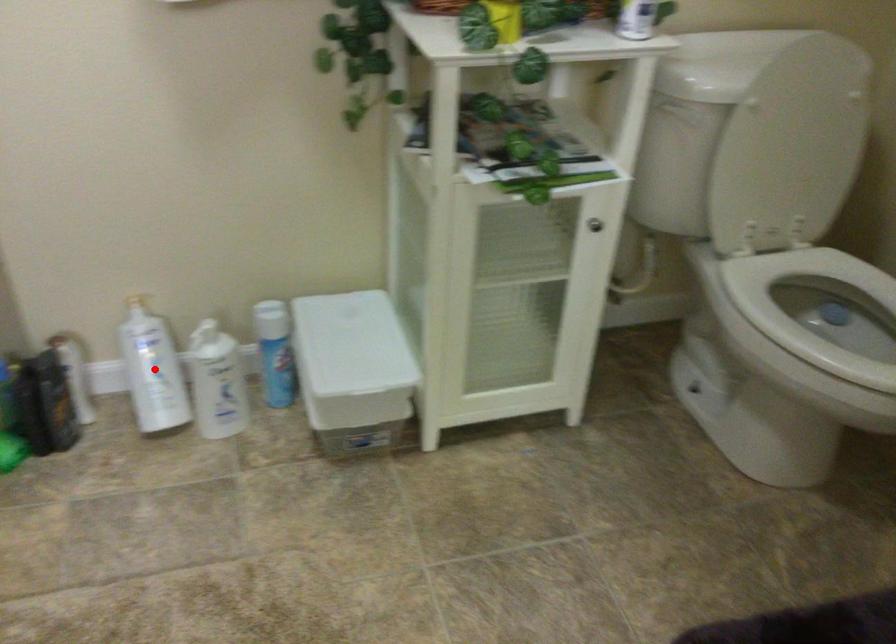
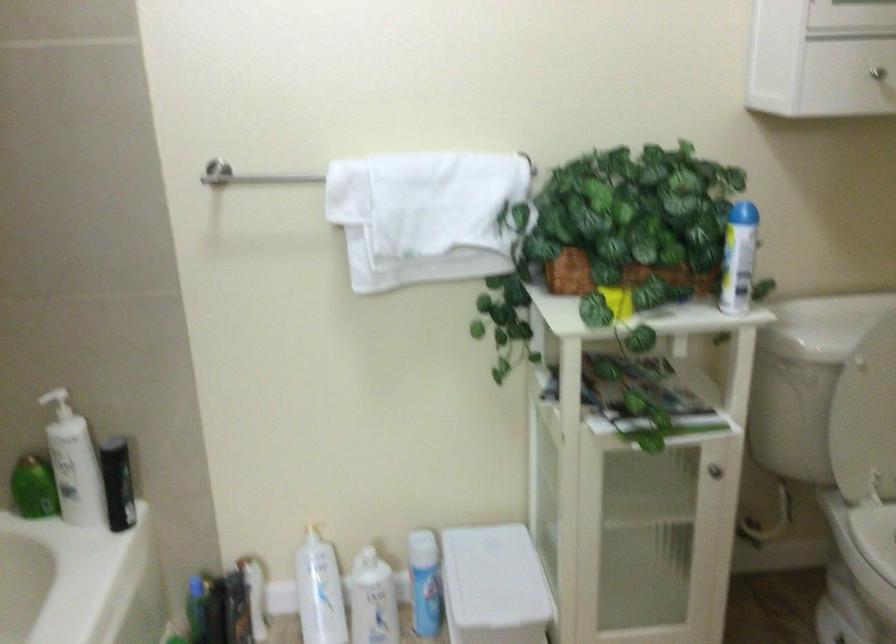
Question: I am providing you with two images of the same scene from different viewpoints. In image1, a red point is highlighted. Considering the same 3D point in image2, which of the following is correct?

Choices:
 (A) It is closer
 (B) It is farther

Answer: (B)